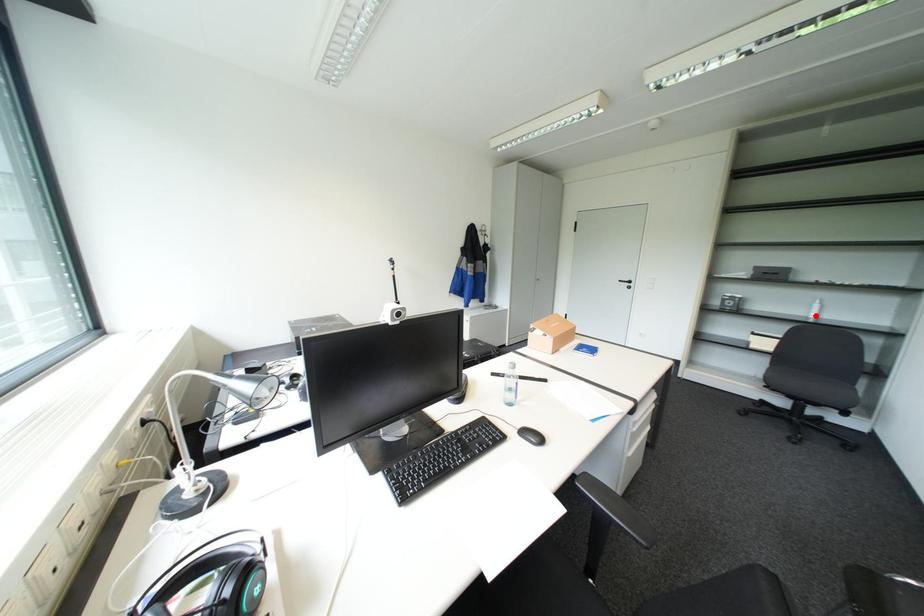
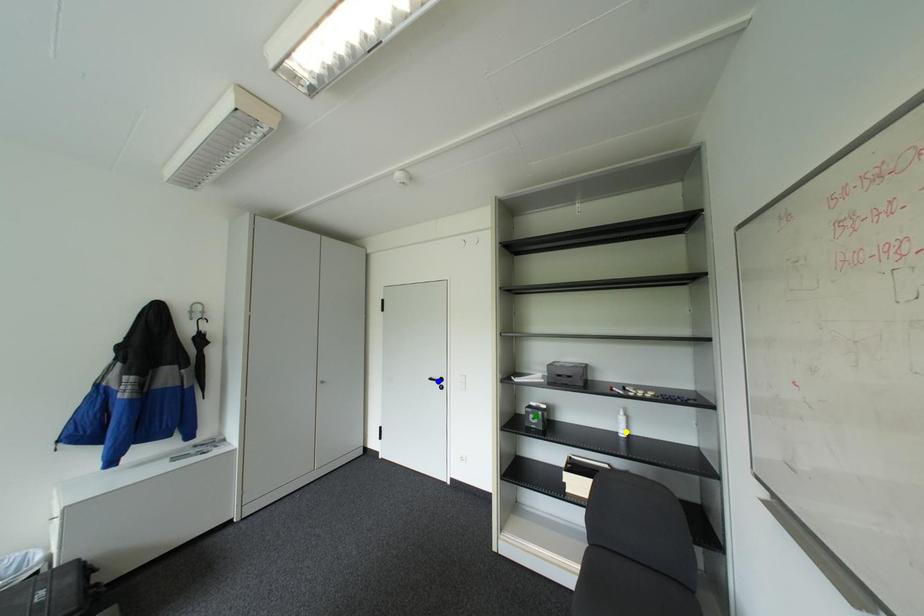
Question: I am providing you with two images of the same scene from different viewpoints. A red point is marked on the first image. You are given multiple points on the second image. Which mark in image 2 goes with the point in image 1?

Choices:
 (A) green point
 (B) yellow point
 (C) blue point

Answer: (B)